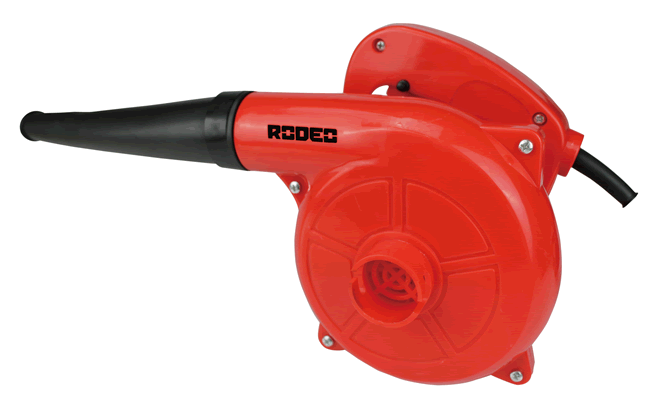
Find the location of a particular element. This screenshot has width=650, height=398. stand is located at coordinates (528, 374), (333, 347).